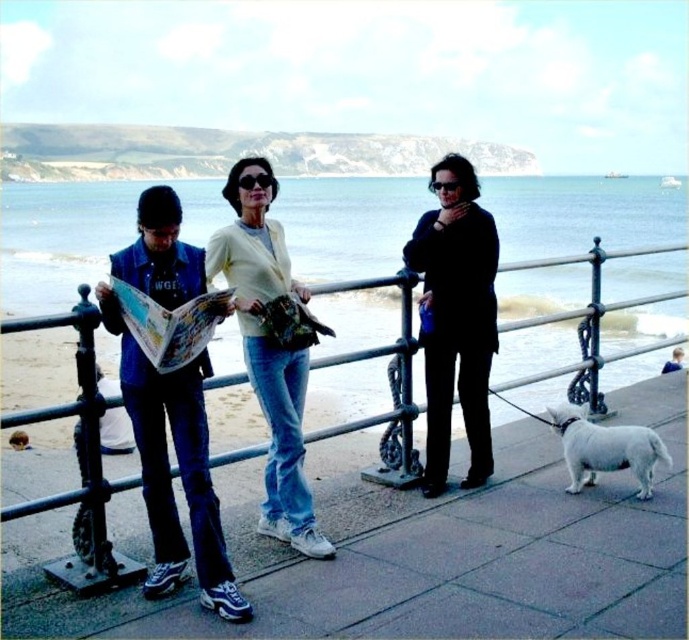
You are a photographer standing at the seaside promenade. You want to take a photo that includes both the light yellow fabric jacket at center and the white fur dog at lower right. Given that your camera has a maximum focus range of 20 feet, will you be able to capture both subjects in focus?

The light yellow fabric jacket at center and the white fur dog at lower right are 18.93 feet apart from each other. Since the distance between them is within the camera maximum focus range of 20 feet, you can capture both subjects in focus.

You are a photographer trying to capture a photo of the light yellow fabric jacket at center without including the denim jacket at left in the frame. Based on their positions, is this possible?

The denim jacket at left is in front of the light yellow fabric jacket at center, so it would block the view. Therefore, it is not possible to capture a photo of the light yellow fabric jacket at center without including the denim jacket at left in the frame.

You are a photographer trying to capture a photo of the light yellow fabric jacket at center and the white fur dog at lower right. Since you want both subjects to be clearly visible in the frame, which subject should you focus on first to ensure proper focus, considering their sizes?

The light yellow fabric jacket at center has a greater height compared to the white fur dog at lower right, so you should focus on the light yellow fabric jacket at center first as it is larger and requires more attention to ensure clarity.